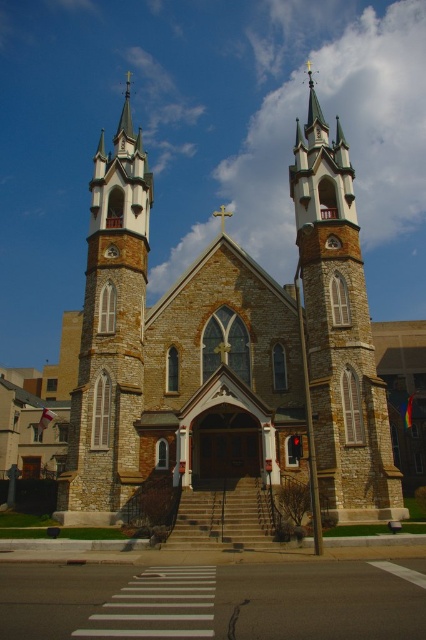
Is stone church at center positioned at the back of stone steeple at left?

That is False.

Can you confirm if stone church at center is positioned to the right of stone steeple at left?

Indeed, stone church at center is positioned on the right side of stone steeple at left.

Does point (124, 291) come in front of point (146, 272)?

Yes, point (124, 291) is in front of point (146, 272).

Where is `stone church at center`? stone church at center is located at coordinates (227, 352).

Who is positioned more to the right, stone steeple at center or stone steeple at left?

stone steeple at center is more to the right.

Is stone steeple at center wider than stone steeple at left?

No.

Locate an element on the screen. stone steeple at center is located at coordinates (339, 332).

You are a GUI agent. You are given a task and a screenshot of the screen. Output one action in this format:
    pyautogui.click(x=<x>, y=<y>)
    Task: Click on the stone steeple at center
    The image size is (426, 640).
    Given the screenshot: What is the action you would take?
    pyautogui.click(x=339, y=332)

Can you confirm if stone church at center is wider than stone steeple at center?

Indeed, stone church at center has a greater width compared to stone steeple at center.

Does point (311, 132) come behind point (310, 240)?

Yes, point (311, 132) is behind point (310, 240).

Describe the element at coordinates (227, 352) in the screenshot. I see `stone church at center` at that location.

Locate an element on the screen. This screenshot has width=426, height=640. stone church at center is located at coordinates (227, 352).